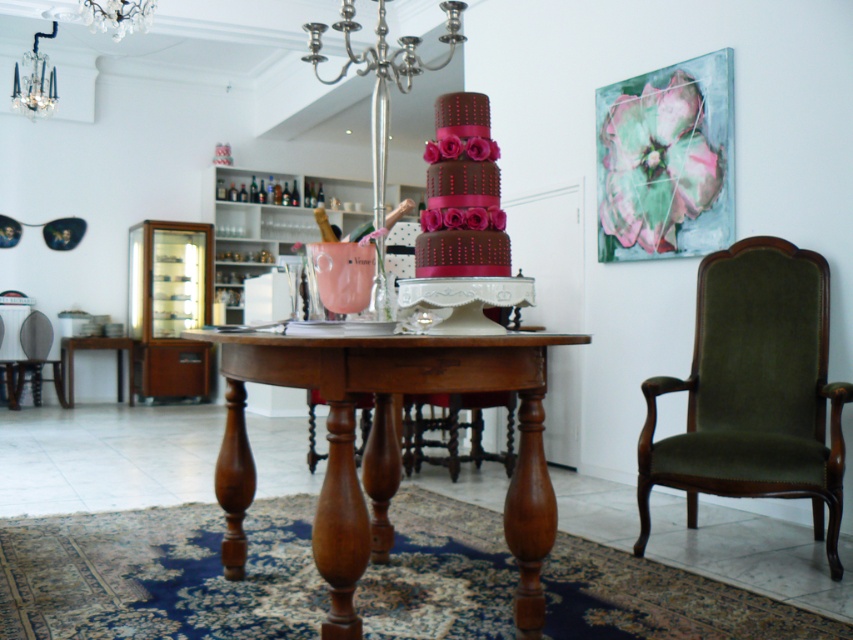
Question: Which object is positioned closest to the velvet green armchair at right?

Choices:
 (A) mahogany wood round table at center
 (B) wooden table at lower left
 (C) velvet green armchair at left
 (D) silver metallic chandelier at upper left

Answer: (A)

Question: Which point is closer to the camera?

Choices:
 (A) matte chocolate cake with pink roses at center
 (B) wooden table at lower left
 (C) mahogany wood round table at center
 (D) silver metallic chandelier at upper left

Answer: (C)

Question: Is mahogany wood round table at center closer to the viewer compared to velvet green armchair at left?

Choices:
 (A) yes
 (B) no

Answer: (A)

Question: Is matte chocolate cake with pink roses at center to the right of crystal glass chandelier at upper center from the viewer's perspective?

Choices:
 (A) yes
 (B) no

Answer: (A)

Question: Which object is positioned closest to the mahogany wood round table at center?

Choices:
 (A) wooden table at lower left
 (B) velvet green armchair at left
 (C) matte chocolate cake with pink roses at center
 (D) crystal glass chandelier at upper center

Answer: (C)

Question: Does velvet green armchair at right appear on the left side of matte chocolate cake with pink roses at center?

Choices:
 (A) yes
 (B) no

Answer: (B)